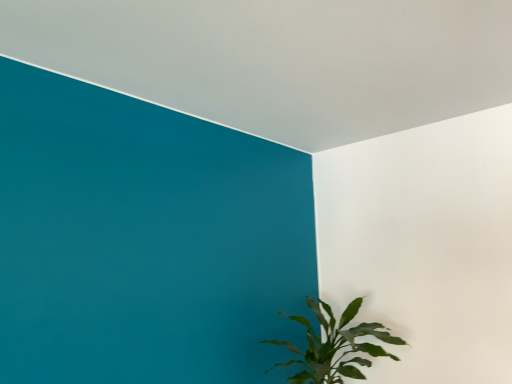
This screenshot has height=384, width=512. Find the location of `green leafy plant at lower right`. green leafy plant at lower right is located at coordinates (335, 345).

This screenshot has height=384, width=512. Describe the element at coordinates (335, 345) in the screenshot. I see `green leafy plant at lower right` at that location.

At what (x,y) coordinates should I click in order to perform the action: click on green leafy plant at lower right. Please return your answer as a coordinate pair (x, y). Looking at the image, I should click on 335,345.